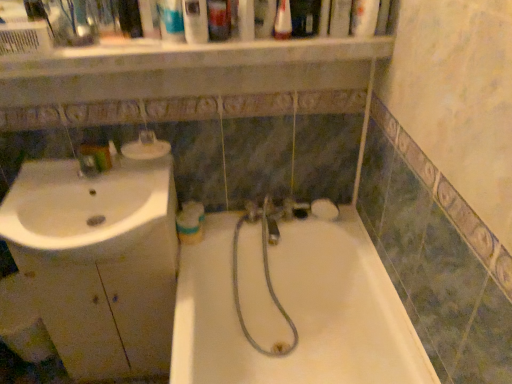
You are a GUI agent. You are given a task and a screenshot of the screen. Output one action in this format:
    pyautogui.click(x=<x>, y=<y>)
    Task: Click on the white glossy sink at left
    The image size is (512, 384).
    Given the screenshot: What is the action you would take?
    pyautogui.click(x=88, y=208)

Image resolution: width=512 pixels, height=384 pixels. Find the location of `translucent plastic soap dispenser at upper center, positioned as the 1th toiletry in top-to-bottom order`. translucent plastic soap dispenser at upper center, positioned as the 1th toiletry in top-to-bottom order is located at coordinates (219, 19).

You are a GUI agent. You are given a task and a screenshot of the screen. Output one action in this format:
    pyautogui.click(x=<x>, y=<y>)
    Task: Click on the clear plastic mouthwash at upper center, placed as the 2th mouthwash when sorted from top to bottom
    This screenshot has width=512, height=384.
    Given the screenshot: What is the action you would take?
    pyautogui.click(x=195, y=21)

From the picture: What is the approximate width of white glossy sink at left?

It is 10.72 inches.

Image resolution: width=512 pixels, height=384 pixels. What do you see at coordinates (99, 261) in the screenshot?
I see `white glossy sink at left` at bounding box center [99, 261].

At what (x,y) coordinates should I click in order to perform the action: click on white glossy bathtub at center. Please return your answer as a coordinate pair (x, y). The height and width of the screenshot is (384, 512). Looking at the image, I should click on (297, 310).

Locate an element on the screen. The image size is (512, 384). white glossy sink at left is located at coordinates (88, 208).

Is clear plastic bottle at upper center, the 4th mouthwash positioned from the left, not close to white glossy sink at left?

No, there isn't a large distance between clear plastic bottle at upper center, the 4th mouthwash positioned from the left, and white glossy sink at left.

Between clear plastic bottle at upper center, which is counted as the 1th mouthwash, starting from the right, and white glossy sink at left, which one has larger size?

white glossy sink at left.

Measure the distance between clear plastic bottle at upper center, the fourth mouthwash positioned from the bottom, and white glossy sink at left.

They are 37.09 inches apart.

Identify the location of porcelain behind the clear plastic bottle at upper center, which appears as the 1th mouthwash when viewed from the top. Image resolution: width=512 pixels, height=384 pixels. (99, 261).

Can you confirm if matte plastic container at upper left, which is the first toiletry from bottom to top, is positioned to the right of white glossy sink at left?

Indeed, matte plastic container at upper left, which is the first toiletry from bottom to top, is positioned on the right side of white glossy sink at left.

Is point (120, 158) closer or farther from the camera than point (160, 313)?

Point (120, 158) is closer to the camera than point (160, 313).

From the image's perspective, which one is positioned higher, matte plastic container at upper left, arranged as the 2th toiletry when viewed from the top, or white glossy sink at left?

From the image's view, matte plastic container at upper left, arranged as the 2th toiletry when viewed from the top, is above.

From the image's perspective, is clear plastic bottle at upper center, the 4th mouthwash positioned from the left, positioned above or below translucent plastic soap dispenser at upper center, positioned as the 1th toiletry in top-to-bottom order?

Based on their image positions, clear plastic bottle at upper center, the 4th mouthwash positioned from the left, is located above translucent plastic soap dispenser at upper center, positioned as the 1th toiletry in top-to-bottom order.

Between clear plastic bottle at upper center, the 4th mouthwash positioned from the left, and translucent plastic soap dispenser at upper center, the 2th toiletry from the left, which one appears on the right side from the viewer's perspective?

clear plastic bottle at upper center, the 4th mouthwash positioned from the left, is more to the right.

From the image's perspective, which toiletry is the 1st one below the clear plastic bottle at upper center, which appears as the 1th mouthwash when viewed from the top? Please provide its 2D coordinates.

[(219, 19)]

Does point (164, 23) come farther from viewer compared to point (190, 312)?

No, (164, 23) is in front of (190, 312).

Does blue plastic mouthwash at upper center, which appears as the second mouthwash when viewed from the back, have a lesser height compared to white glossy bathtub at center?

Indeed, blue plastic mouthwash at upper center, which appears as the second mouthwash when viewed from the back, has a lesser height compared to white glossy bathtub at center.

Is blue plastic mouthwash at upper center, the 2th mouthwash positioned from the left, positioned behind white glossy bathtub at center?

Yes, the depth of blue plastic mouthwash at upper center, the 2th mouthwash positioned from the left, is greater than that of white glossy bathtub at center.

Which is more to the right, blue plastic mouthwash at upper center, which is counted as the 3th mouthwash, starting from the front, or white glossy bathtub at center?

white glossy bathtub at center is more to the right.

Considering the positions of objects white glossy bathtub at center and white glossy mouthwash at center, which is the 1th mouthwash in bottom-to-top order, in the image provided, who is more to the right, white glossy bathtub at center or white glossy mouthwash at center, which is the 1th mouthwash in bottom-to-top order,?

From the viewer's perspective, white glossy bathtub at center appears more on the right side.

Looking at this image, from the image's perspective, is white glossy bathtub at center located above or below white glossy mouthwash at center, the 1th mouthwash from the left?

From the image's perspective, white glossy bathtub at center appears below white glossy mouthwash at center, the 1th mouthwash from the left.

Is white glossy mouthwash at center, arranged as the 4th mouthwash when viewed from the right, completely or partially inside white glossy bathtub at center?

No, white glossy mouthwash at center, arranged as the 4th mouthwash when viewed from the right, is not surrounded by white glossy bathtub at center.

Who is more distant, white glossy bathtub at center or white glossy mouthwash at center, arranged as the 4th mouthwash when viewed from the right?

white glossy mouthwash at center, arranged as the 4th mouthwash when viewed from the right, is behind.

From the image's perspective, between white glossy sink at left and white glossy bathtub at center, who is located below?

white glossy bathtub at center.

From the picture: Which of these two, white glossy sink at left or white glossy bathtub at center, is bigger?

With larger size is white glossy bathtub at center.

Is white glossy sink at left not near white glossy bathtub at center?

Actually, white glossy sink at left and white glossy bathtub at center are a little close together.

From a real-world perspective, is white glossy sink at left over clear plastic mouthwash at upper center, the 3th mouthwash when ordered from bottom to top?

No, from a real-world perspective, white glossy sink at left is not above clear plastic mouthwash at upper center, the 3th mouthwash when ordered from bottom to top.

Considering the relative positions of white glossy sink at left and clear plastic mouthwash at upper center, the 3th mouthwash when ordered from left to right, in the image provided, is white glossy sink at left to the left or to the right of clear plastic mouthwash at upper center, the 3th mouthwash when ordered from left to right,?

In the image, white glossy sink at left appears on the left side of clear plastic mouthwash at upper center, the 3th mouthwash when ordered from left to right.

From the picture: Between white glossy sink at left and clear plastic mouthwash at upper center, the 3th mouthwash when ordered from bottom to top, which one has less height?

With less height is clear plastic mouthwash at upper center, the 3th mouthwash when ordered from bottom to top.

You are a GUI agent. You are given a task and a screenshot of the screen. Output one action in this format:
    pyautogui.click(x=<x>, y=<y>)
    Task: Click on the porcelain on the left of clear plastic bottle at upper center, the fourth mouthwash positioned from the bottom
    
    Given the screenshot: What is the action you would take?
    pyautogui.click(x=99, y=261)

Identify the location of porcelain below the matte plastic container at upper left, which is counted as the 1th toiletry, starting from the left (from a real-world perspective). (99, 261).

In the scene shown: Which object lies nearer to the anchor point matte plastic container at upper left, which is the first toiletry from bottom to top, translucent plastic soap dispenser at upper center, the 2th toiletry from the left, or blue plastic mouthwash at upper center, which ranks as the third mouthwash in top-to-bottom order?

blue plastic mouthwash at upper center, which ranks as the third mouthwash in top-to-bottom order, lies closer to matte plastic container at upper left, which is the first toiletry from bottom to top, than the other object.

Looking at the image, which one is located further to white glossy sink at left, white glossy sink at left or translucent plastic soap dispenser at upper center, the first toiletry viewed from the right?

translucent plastic soap dispenser at upper center, the first toiletry viewed from the right, is positioned further to the anchor white glossy sink at left.

From the image, which object appears to be farther from blue plastic mouthwash at upper center, the 2th mouthwash positioned from the left, white glossy sink at left or white glossy mouthwash at center, the 1th mouthwash from the left?

Based on the image, white glossy mouthwash at center, the 1th mouthwash from the left, appears to be further to blue plastic mouthwash at upper center, the 2th mouthwash positioned from the left.

From the image, which object appears to be farther from white glossy sink at left, matte plastic container at upper left, the second toiletry from the front, or clear plastic bottle at upper center, which appears as the second mouthwash when viewed from the front?

The object further to white glossy sink at left is clear plastic bottle at upper center, which appears as the second mouthwash when viewed from the front.

Looking at the image, which one is located further to white glossy bathtub at center, translucent plastic soap dispenser at upper center, the first toiletry viewed from the right, or matte plastic container at upper left, which is counted as the 1th toiletry, starting from the back?

translucent plastic soap dispenser at upper center, the first toiletry viewed from the right, is further to white glossy bathtub at center.

Which object lies further to the anchor point blue plastic mouthwash at upper center, which is the second mouthwash in bottom-to-top order, white glossy sink at left or white glossy sink at left?

white glossy sink at left is further to blue plastic mouthwash at upper center, which is the second mouthwash in bottom-to-top order.

Looking at the image, which one is located closer to white glossy bathtub at center, clear plastic mouthwash at upper center, which is the 4th mouthwash from back to front, or matte plastic container at upper left, the second toiletry positioned from the right?

Among the two, matte plastic container at upper left, the second toiletry positioned from the right, is located nearer to white glossy bathtub at center.

From the image, which object appears to be nearer to white glossy sink at left, white glossy mouthwash at center, which is the 4th mouthwash in top-to-bottom order, or blue plastic mouthwash at upper center, which appears as the second mouthwash when viewed from the back?

white glossy mouthwash at center, which is the 4th mouthwash in top-to-bottom order, is positioned closer to the anchor white glossy sink at left.

The width and height of the screenshot is (512, 384). I want to click on mouthwash situated between blue plastic mouthwash at upper center, which appears as the second mouthwash when viewed from the back, and translucent plastic soap dispenser at upper center, positioned as the second toiletry in bottom-to-top order, from left to right, so click(x=195, y=21).

What are the coordinates of `toiletry between translucent plastic soap dispenser at upper center, the first toiletry viewed from the right, and white glossy sink at left vertically` in the screenshot? It's located at (x=114, y=153).

The image size is (512, 384). I want to click on mouthwash between translucent plastic soap dispenser at upper center, marked as the 1th toiletry in a front-to-back arrangement, and white glossy sink at left in the up-down direction, so click(x=170, y=20).

This screenshot has height=384, width=512. Find the location of `toiletry between blue plastic mouthwash at upper center, the 2th mouthwash positioned from the left, and white glossy sink at left in the up-down direction`. toiletry between blue plastic mouthwash at upper center, the 2th mouthwash positioned from the left, and white glossy sink at left in the up-down direction is located at coordinates [x=114, y=153].